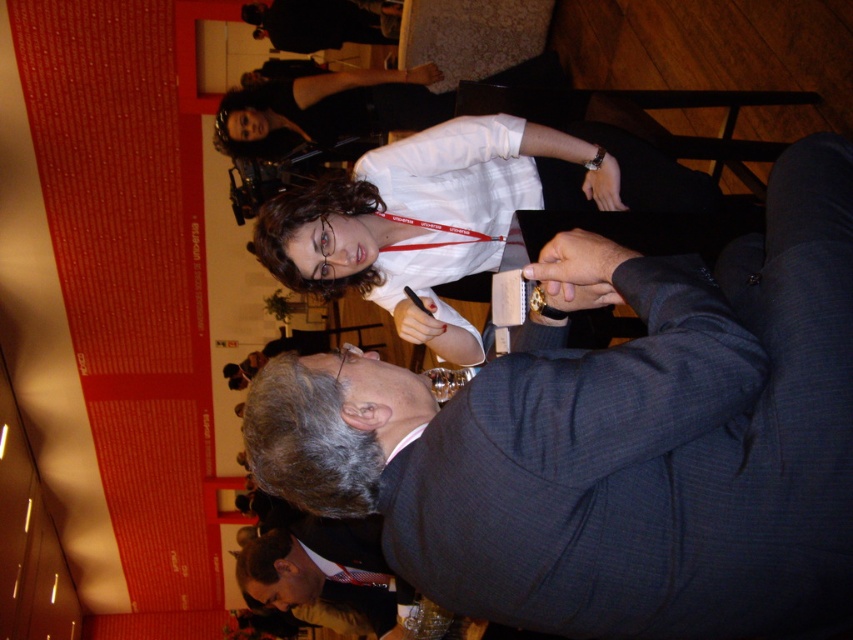
Question: Which point is closer to the camera?

Choices:
 (A) white shirt at center
 (B) dark blue suit at center
 (C) dark gray suit at lower center

Answer: (B)

Question: Does dark blue suit at center lie behind dark gray suit at lower center?

Choices:
 (A) no
 (B) yes

Answer: (A)

Question: Where is white shirt at center located in relation to dark gray suit at lower center in the image?

Choices:
 (A) above
 (B) below

Answer: (A)

Question: Among these objects, which one is farthest from the camera?

Choices:
 (A) white shirt at center
 (B) dark gray suit at lower center

Answer: (B)

Question: Which object is closer to the camera taking this photo?

Choices:
 (A) white shirt at center
 (B) dark gray suit at lower center
 (C) dark blue suit at center

Answer: (C)

Question: Does dark blue suit at center have a smaller size compared to white shirt at center?

Choices:
 (A) yes
 (B) no

Answer: (A)